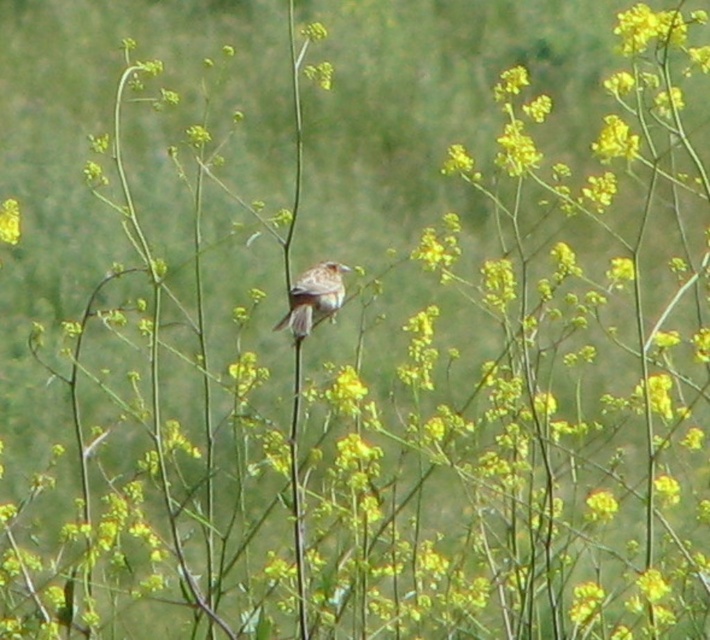
Question: Among these points, which one is nearest to the camera?

Choices:
 (A) (317, 268)
 (B) (11, 218)

Answer: (A)

Question: Is brown feathered bird at center wider than yellow matte flower at center?

Choices:
 (A) yes
 (B) no

Answer: (A)

Question: Which object is closer to the camera taking this photo?

Choices:
 (A) yellow matte flower at center
 (B) brown feathered bird at center

Answer: (B)

Question: Is brown feathered bird at center smaller than yellow matte flower at center?

Choices:
 (A) yes
 (B) no

Answer: (B)

Question: Does brown feathered bird at center have a greater width compared to yellow matte flower at center?

Choices:
 (A) yes
 (B) no

Answer: (A)